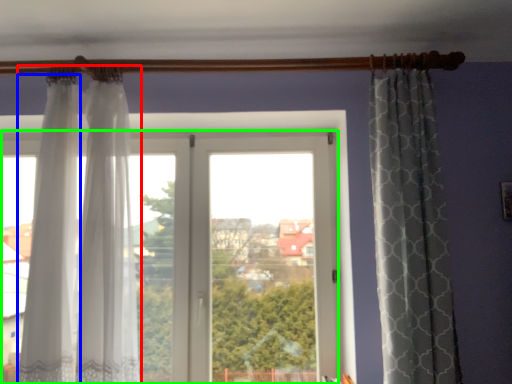
Question: Based on their relative distances, which object is farther from curtain (highlighted by a red box)? Choose from curtain (highlighted by a blue box) and window (highlighted by a green box).

Choices:
 (A) curtain
 (B) window

Answer: (B)